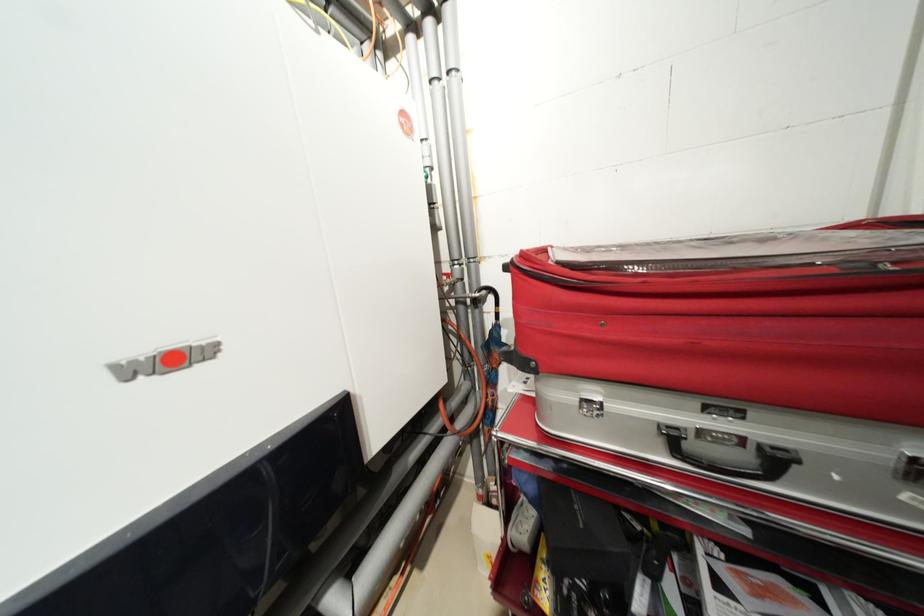
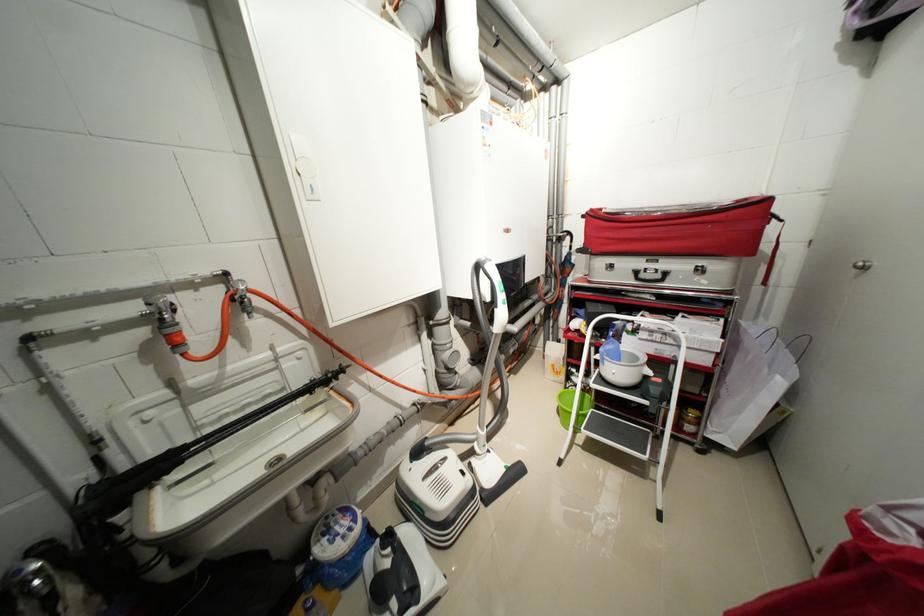
Locate, in the second image, the point that corresponds to (x=530, y=256) in the first image.

(599, 211)